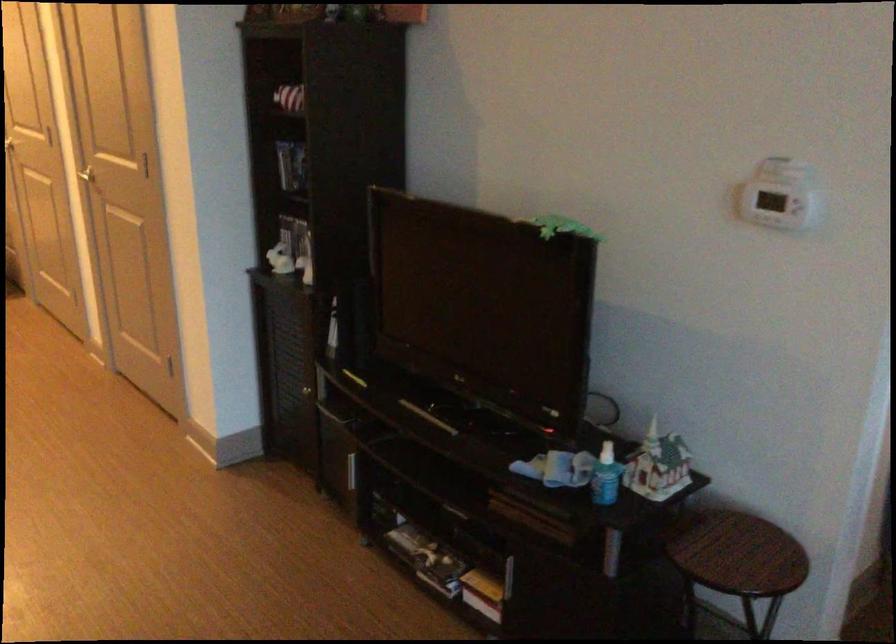
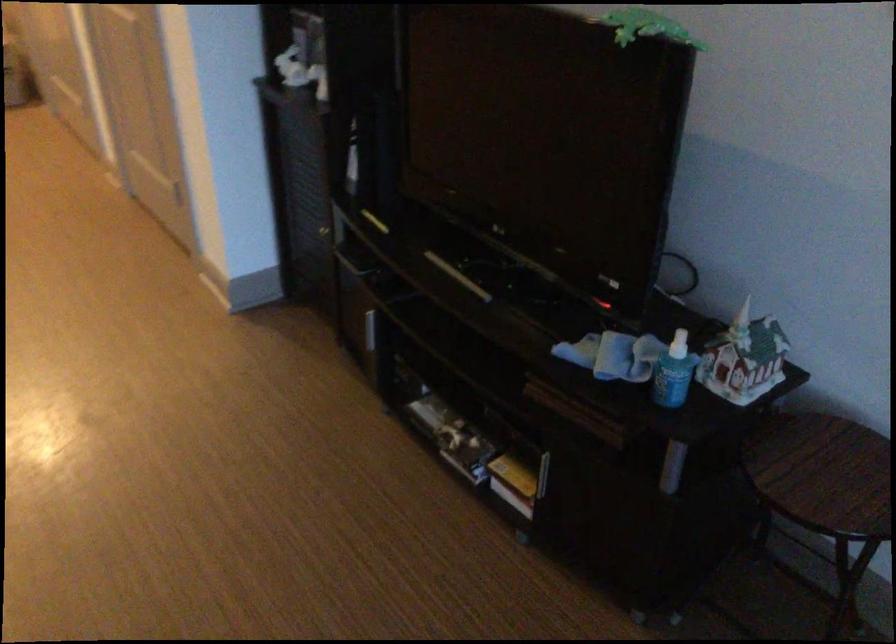
Question: The first image is from the beginning of the video and the second image is from the end. How did the camera likely rotate when shooting the video?

Choices:
 (A) Left
 (B) Right
 (C) Up
 (D) Down

Answer: (D)